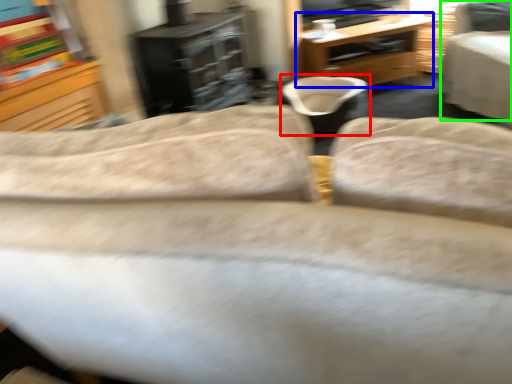
Question: Which is nearer to the bean bag chair (highlighted by a red box)? desk (highlighted by a blue box) or chair (highlighted by a green box).

Choices:
 (A) desk
 (B) chair

Answer: (A)